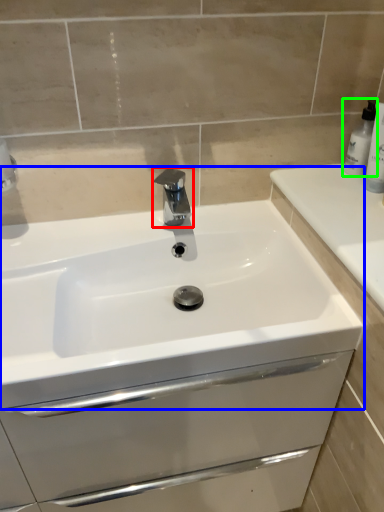
Question: Considering the real-world distances, which object is farthest from tap (highlighted by a red box)? sink (highlighted by a blue box) or soap dispenser (highlighted by a green box)?

Choices:
 (A) sink
 (B) soap dispenser

Answer: (B)